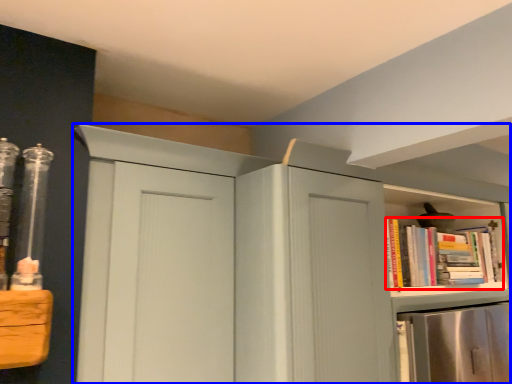
Question: Which object is further to the camera taking this photo, book (highlighted by a red box) or cupboard (highlighted by a blue box)?

Choices:
 (A) book
 (B) cupboard

Answer: (A)